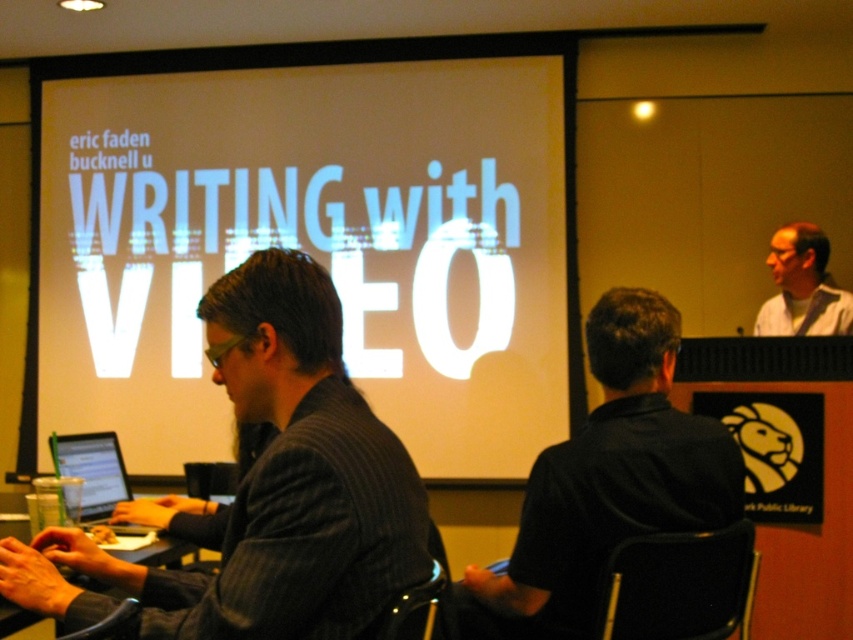
Is point (212, 534) farther from camera compared to point (54, 467)?

No, (212, 534) is closer to viewer.

The image size is (853, 640). In order to click on dark gray suit at center in this screenshot , I will do `click(267, 486)`.

Identify the location of dark gray suit at center. (267, 486).

Looking at this image, can you confirm if white matte projection screen at center is taller than black shirt at center?

Correct, white matte projection screen at center is much taller as black shirt at center.

Where is `white matte projection screen at center`? The width and height of the screenshot is (853, 640). white matte projection screen at center is located at coordinates (312, 241).

Which of these two, dark gray suit at center or gray fabric shirt at upper right, stands taller?

dark gray suit at center

Does point (317, 602) come closer to viewer compared to point (787, 316)?

Yes, point (317, 602) is closer to viewer.

What do you see at coordinates (267, 486) in the screenshot? I see `dark gray suit at center` at bounding box center [267, 486].

The height and width of the screenshot is (640, 853). I want to click on dark gray suit at center, so click(267, 486).